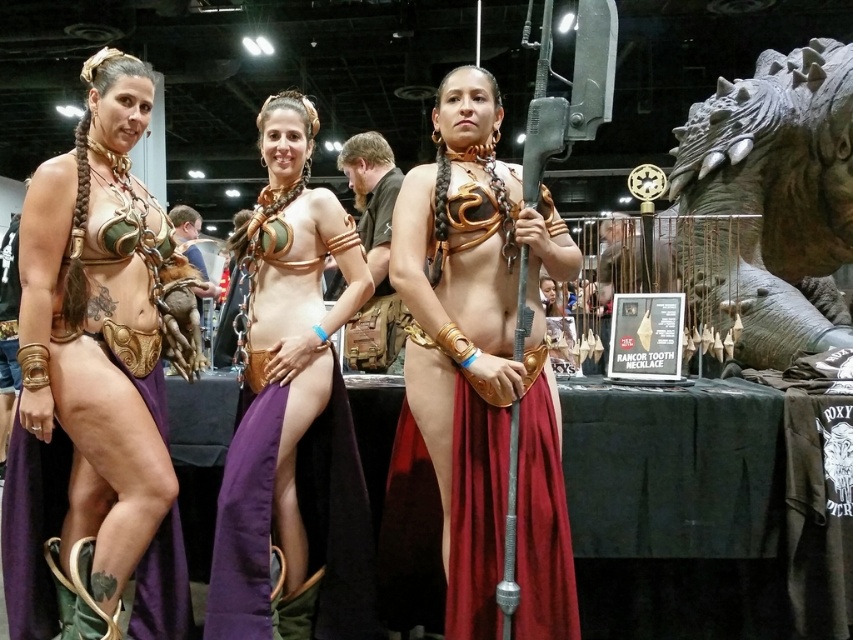
Locate an element on the screen. Image resolution: width=853 pixels, height=640 pixels. gold metallic armor at left is located at coordinates (93, 385).

Between gold metallic armor at left and metallic gold armor at center, which one appears on the right side from the viewer's perspective?

Positioned to the right is metallic gold armor at center.

Image resolution: width=853 pixels, height=640 pixels. What do you see at coordinates (93, 385) in the screenshot?
I see `gold metallic armor at left` at bounding box center [93, 385].

Find the location of a particular element. The width and height of the screenshot is (853, 640). gold metallic armor at left is located at coordinates (93, 385).

Can you confirm if matte gold bikini top at center is thinner than gray stone dragon head at upper right?

Indeed, matte gold bikini top at center has a lesser width compared to gray stone dragon head at upper right.

Does matte gold bikini top at center appear over gray stone dragon head at upper right?

Incorrect, matte gold bikini top at center is not positioned above gray stone dragon head at upper right.

Is point (276, 388) behind point (822, 316)?

No, it is not.

The image size is (853, 640). I want to click on matte gold bikini top at center, so (x=293, y=412).

Who is more forward, (554, 630) or (349, 611)?

Point (554, 630) is more forward.

Is metallic gold armor at center wider than matte gold bikini top at center?

Yes, metallic gold armor at center is wider than matte gold bikini top at center.

Does point (402, 298) come farther from viewer compared to point (242, 264)?

No, (402, 298) is closer to viewer.

Image resolution: width=853 pixels, height=640 pixels. Find the location of `metallic gold armor at center`. metallic gold armor at center is located at coordinates (480, 369).